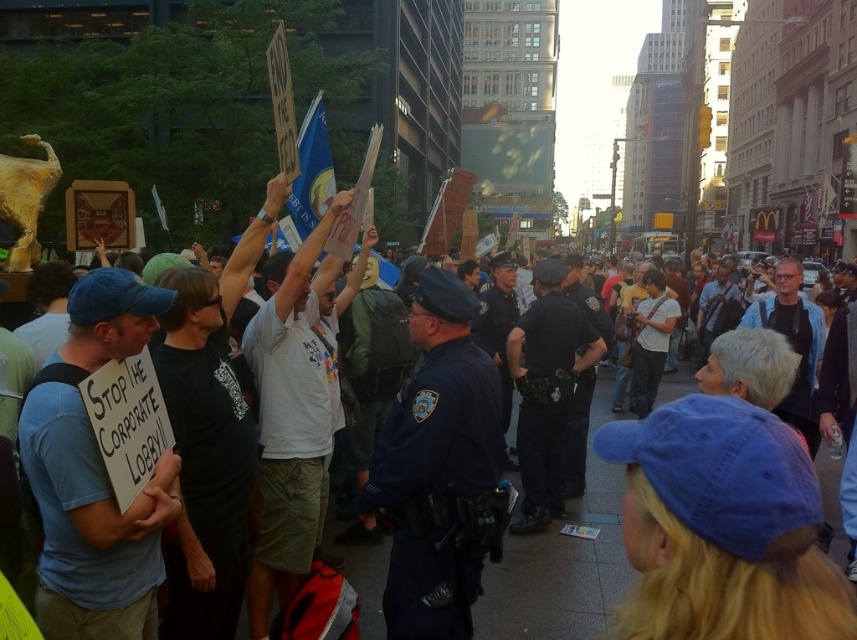
Question: Among these points, which one is farthest from the camera?

Choices:
 (A) (x=432, y=630)
 (B) (x=577, y=332)

Answer: (B)

Question: Which object appears farthest from the camera in this image?

Choices:
 (A) dark blue uniform at center
 (B) blue uniformed officer at center

Answer: (A)

Question: Does blue uniformed officer at center have a lesser width compared to dark blue uniform at center?

Choices:
 (A) no
 (B) yes

Answer: (B)

Question: Is blue uniformed officer at center smaller than dark blue uniform at center?

Choices:
 (A) yes
 (B) no

Answer: (A)

Question: Which point appears closest to the camera in this image?

Choices:
 (A) (561, 496)
 (B) (426, 403)

Answer: (B)

Question: Is blue uniformed officer at center closer to the viewer compared to dark blue uniform at center?

Choices:
 (A) no
 (B) yes

Answer: (B)